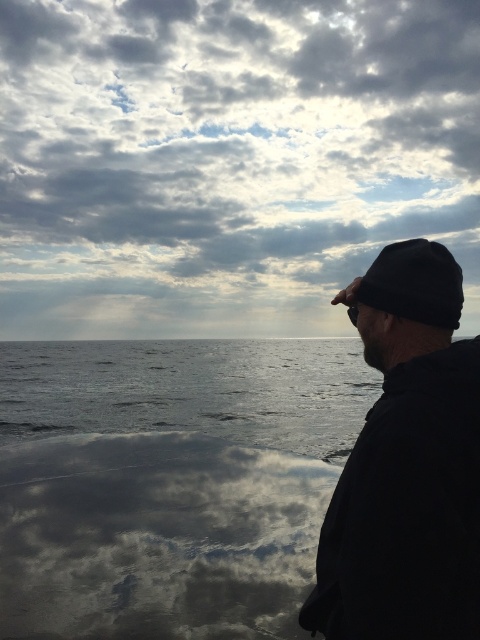
Measure the distance between cloudy sky at upper center and black matte beanie at right.

cloudy sky at upper center is 72.27 meters away from black matte beanie at right.

The height and width of the screenshot is (640, 480). Describe the element at coordinates (227, 157) in the screenshot. I see `cloudy sky at upper center` at that location.

Which is behind, point (285, 26) or point (459, 449)?

The point (285, 26) is more distant.

You are a GUI agent. You are given a task and a screenshot of the screen. Output one action in this format:
    pyautogui.click(x=<x>, y=<y>)
    Task: Click on the cloudy sky at upper center
    The image size is (480, 640).
    Given the screenshot: What is the action you would take?
    pyautogui.click(x=227, y=157)